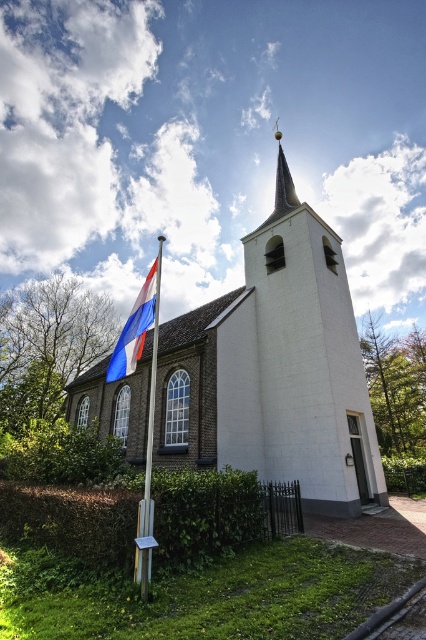
Who is lower down, blue-white striped flag at left or polished metal flag pole at center-left?

Positioned lower is polished metal flag pole at center-left.

Who is shorter, blue-white striped flag at left or polished metal flag pole at center-left?

blue-white striped flag at left

Where is `blue-white striped flag at left`? blue-white striped flag at left is located at coordinates pos(135,324).

Image resolution: width=426 pixels, height=640 pixels. Describe the element at coordinates (275, 369) in the screenshot. I see `white brick church at center` at that location.

Is white brick church at center to the right of blue-white striped flag at left from the viewer's perspective?

Indeed, white brick church at center is positioned on the right side of blue-white striped flag at left.

The width and height of the screenshot is (426, 640). In order to click on white brick church at center in this screenshot , I will do (275, 369).

Does white brick church at center have a greater height compared to polished metal flag pole at center-left?

No.

Is white brick church at center shorter than polished metal flag pole at center-left?

Indeed, white brick church at center has a lesser height compared to polished metal flag pole at center-left.

Image resolution: width=426 pixels, height=640 pixels. What do you see at coordinates (275, 369) in the screenshot? I see `white brick church at center` at bounding box center [275, 369].

The image size is (426, 640). I want to click on white brick church at center, so click(275, 369).